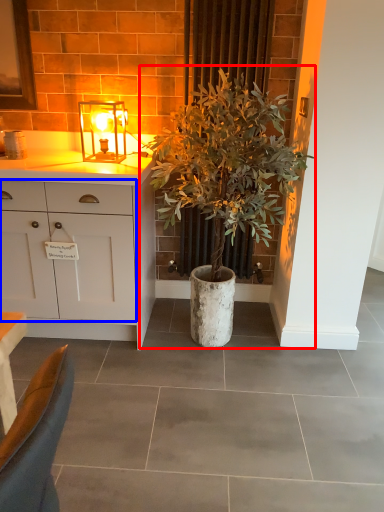
Question: Which point is closer to the camera, houseplant (highlighted by a red box) or cabinetry (highlighted by a blue box)?

Choices:
 (A) houseplant
 (B) cabinetry

Answer: (A)